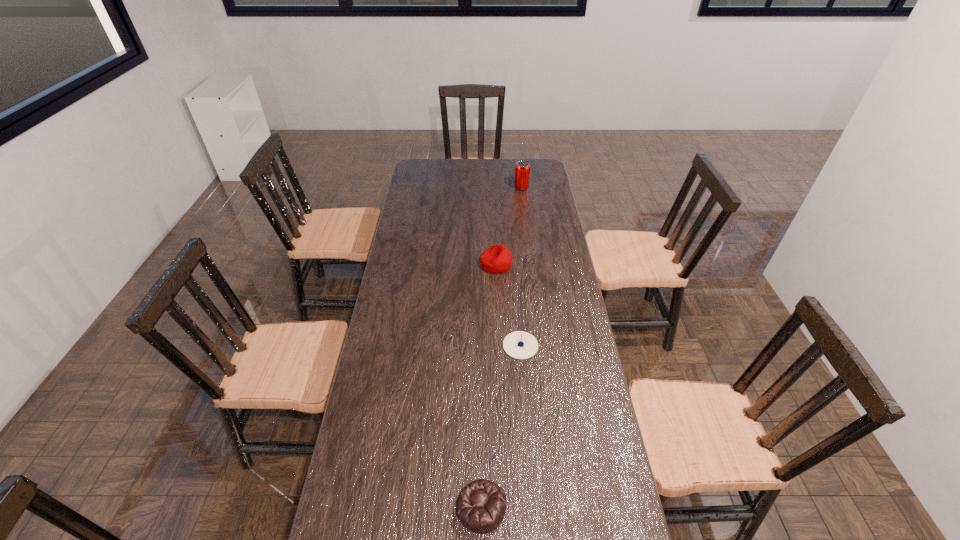
Locate an element on the screen. This screenshot has height=540, width=960. the tallest object is located at coordinates (522, 169).

Where is `soda can`? This screenshot has width=960, height=540. soda can is located at coordinates (522, 169).

Where is `the third nearest object`? Image resolution: width=960 pixels, height=540 pixels. the third nearest object is located at coordinates (496, 259).

Where is `the farther beanbag`? the farther beanbag is located at coordinates (496, 259).

You are a GUI agent. You are given a task and a screenshot of the screen. Output one action in this format:
    pyautogui.click(x=<x>, y=<y>)
    Task: Click on the second nearest object
    This screenshot has width=960, height=540.
    Given the screenshot: What is the action you would take?
    click(x=521, y=345)

Identify the location of the nearer beanbag. The image size is (960, 540). (481, 505).

You are a GUI agent. You are given a task and a screenshot of the screen. Output one action in this format:
    pyautogui.click(x=<x>, y=<y>)
    Task: Click on the shorter beanbag
    The height and width of the screenshot is (540, 960).
    Given the screenshot: What is the action you would take?
    pyautogui.click(x=481, y=505)

What are the coordinates of `vacant space situated on the front of the soda can` in the screenshot? It's located at (522, 197).

You are a GUI agent. You are given a task and a screenshot of the screen. Output one action in this format:
    pyautogui.click(x=<x>, y=<y>)
    Task: Click on the vacant point located 0.320m on the seat area of the taller beanbag
    
    Given the screenshot: What is the action you would take?
    pyautogui.click(x=402, y=264)

Locate an element on the screen. This screenshot has width=960, height=540. free space located 0.130m on the seat area of the taller beanbag is located at coordinates (448, 264).